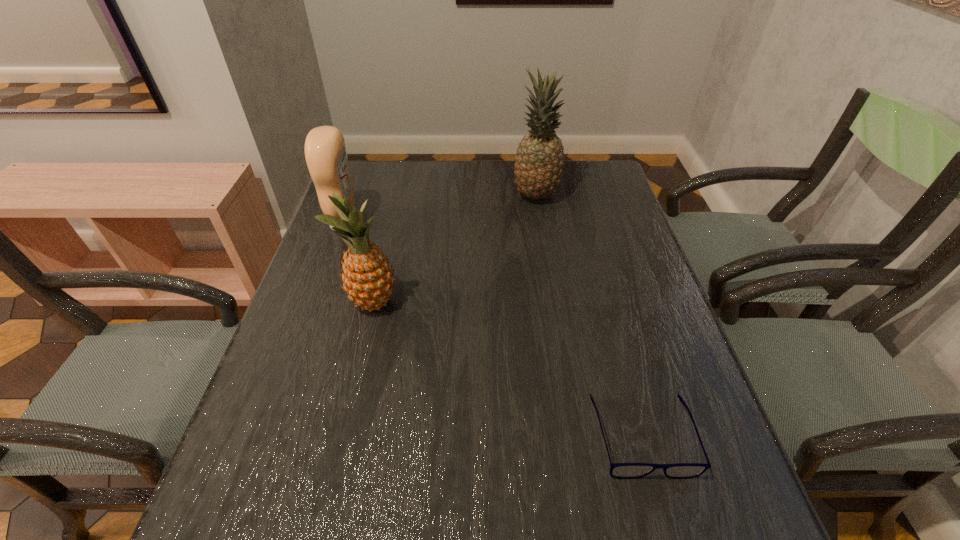
The width and height of the screenshot is (960, 540). Identify the location of object that can be found as the third closest to the leftmost object. (617, 470).

Find the location of a particular element. vacant space that satisfies the following two spatial constraints: 1. on the label of the condiment; 2. on the back side of the nearer pineapple is located at coordinates (316, 303).

Locate an element on the screen. Image resolution: width=960 pixels, height=540 pixels. free space that satisfies the following two spatial constraints: 1. on the label of the condiment; 2. on the left side of the second object from left to right is located at coordinates (316, 303).

Where is `vacant space that satisfies the following two spatial constraints: 1. on the label of the condiment; 2. on the back side of the left pineapple`? Image resolution: width=960 pixels, height=540 pixels. vacant space that satisfies the following two spatial constraints: 1. on the label of the condiment; 2. on the back side of the left pineapple is located at coordinates (316, 303).

Locate an element on the screen. free space that satisfies the following two spatial constraints: 1. on the front side of the farther pineapple; 2. on the label of the leftmost object is located at coordinates click(540, 224).